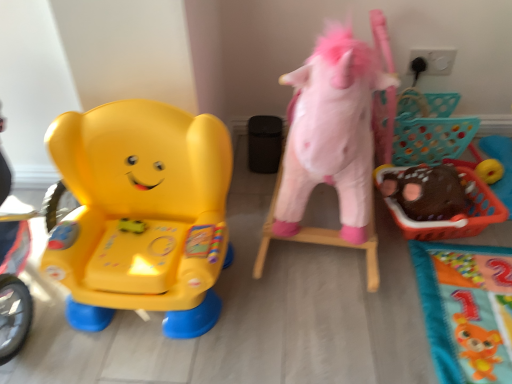
The height and width of the screenshot is (384, 512). Identify the location of space that is in front of matte plastic elephant at left, which appears as the third toy when viewed from the right. (185, 351).